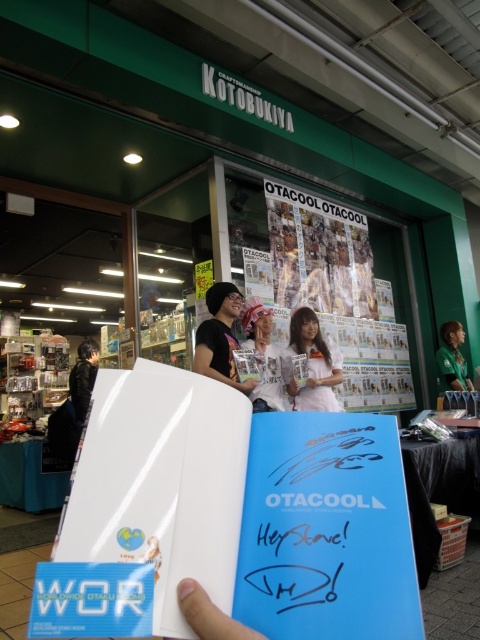
Can you confirm if matte black shirt at center is taller than black leather jacket at left?

In fact, matte black shirt at center may be shorter than black leather jacket at left.

Between matte black shirt at center and black leather jacket at left, which one appears on the right side from the viewer's perspective?

From the viewer's perspective, matte black shirt at center appears more on the right side.

Does point (229, 381) lie in front of point (81, 358)?

Yes, it is.

The width and height of the screenshot is (480, 640). In order to click on matte black shirt at center in this screenshot , I will do [219, 337].

Can you confirm if white paperboard at center is bigger than green fabric shirt at right?

Indeed, white paperboard at center has a larger size compared to green fabric shirt at right.

How far apart are white paperboard at center and green fabric shirt at right?

white paperboard at center and green fabric shirt at right are 89.88 centimeters apart.

Is point (320, 208) less distant than point (462, 378)?

Yes.

Locate an element on the screen. Image resolution: width=480 pixels, height=640 pixels. white paperboard at center is located at coordinates (338, 292).

Is matte black shirt at center shorter than blue matte book at center?

Incorrect, matte black shirt at center's height does not fall short of blue matte book at center's.

Who is shorter, matte black shirt at center or blue matte book at center?

blue matte book at center

Between point (235, 305) and point (300, 362), which one is positioned in front?

Point (300, 362)

I want to click on matte black shirt at center, so click(219, 337).